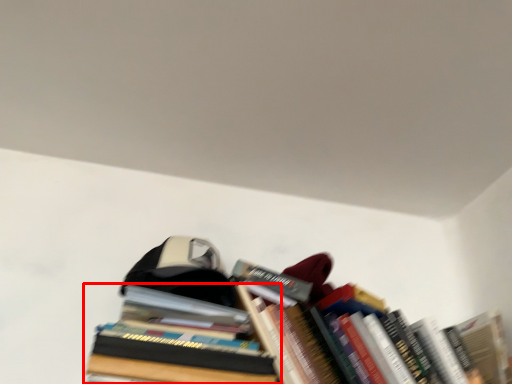
Question: From the image, what is the correct spatial relationship of book (annotated by the red box) in relation to book?

Choices:
 (A) left
 (B) right

Answer: (A)